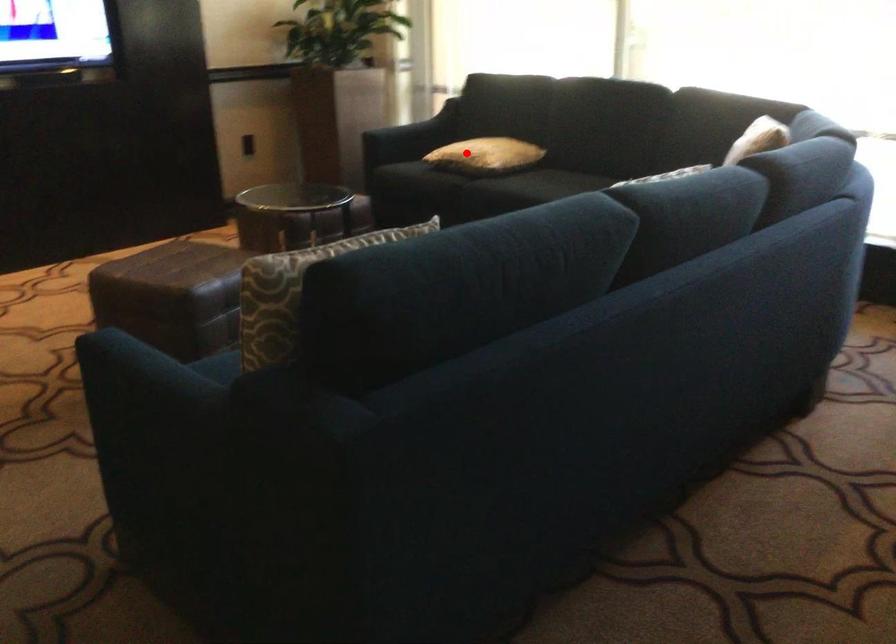
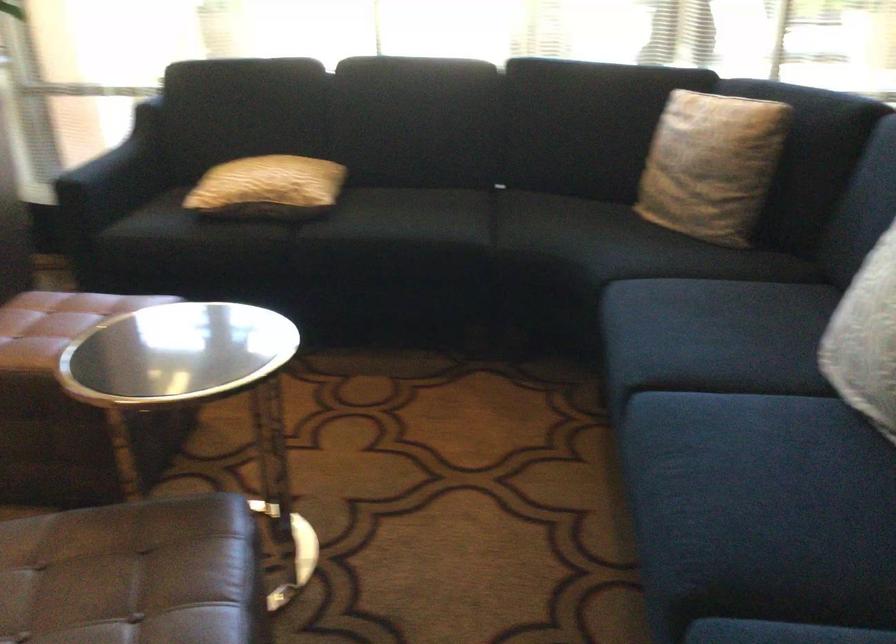
In the second image, find the point that corresponds to the highlighted location in the first image.

(268, 187)